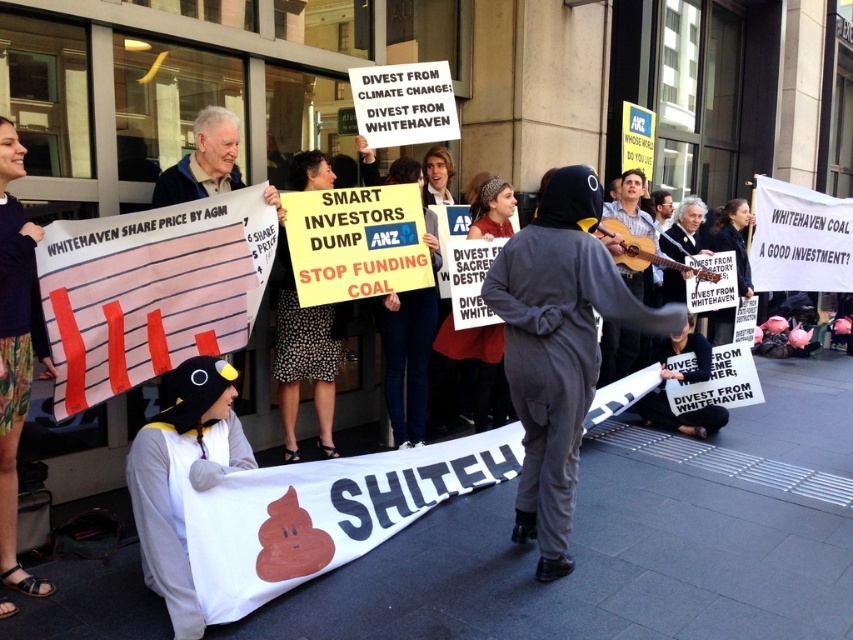
Question: From the image, what is the correct spatial relationship of floral skirt at lower left in relation to black fabric sign at lower center?

Choices:
 (A) above
 (B) below

Answer: (A)

Question: Which point is farther to the camera?

Choices:
 (A) (146, 451)
 (B) (527, 410)

Answer: (B)

Question: Which point is closer to the camera?

Choices:
 (A) (163, 481)
 (B) (663, 330)

Answer: (A)

Question: Which object appears farthest from the camera in this image?

Choices:
 (A) gray penguin costume at lower left
 (B) black fabric sign at lower center

Answer: (B)

Question: Can you confirm if floral skirt at lower left is positioned to the left of black fabric sign at lower center?

Choices:
 (A) no
 (B) yes

Answer: (B)

Question: Is floral skirt at lower left smaller than black fabric sign at lower center?

Choices:
 (A) no
 (B) yes

Answer: (B)